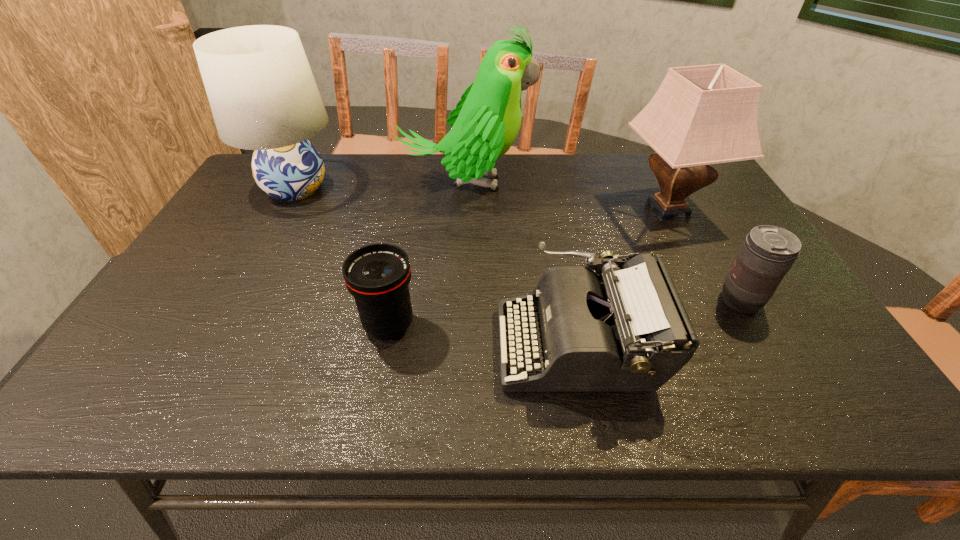
The width and height of the screenshot is (960, 540). What are the coordinates of `free space between the left telephoto lens and the right lampshade` in the screenshot? It's located at (528, 267).

Identify the location of vacant area that lies between the typewriter and the left lampshade. This screenshot has height=540, width=960. (437, 266).

The height and width of the screenshot is (540, 960). I want to click on vacant point located between the leftmost object and the parakeet, so click(380, 186).

Image resolution: width=960 pixels, height=540 pixels. Find the location of `free spot between the left telephoto lens and the leftmost object`. free spot between the left telephoto lens and the leftmost object is located at coordinates coord(343,256).

The width and height of the screenshot is (960, 540). What are the coordinates of `the fourth closest object relative to the right lampshade` in the screenshot? It's located at point(377,275).

Image resolution: width=960 pixels, height=540 pixels. Identify the location of the fourth closest object to the right telephoto lens. (377, 275).